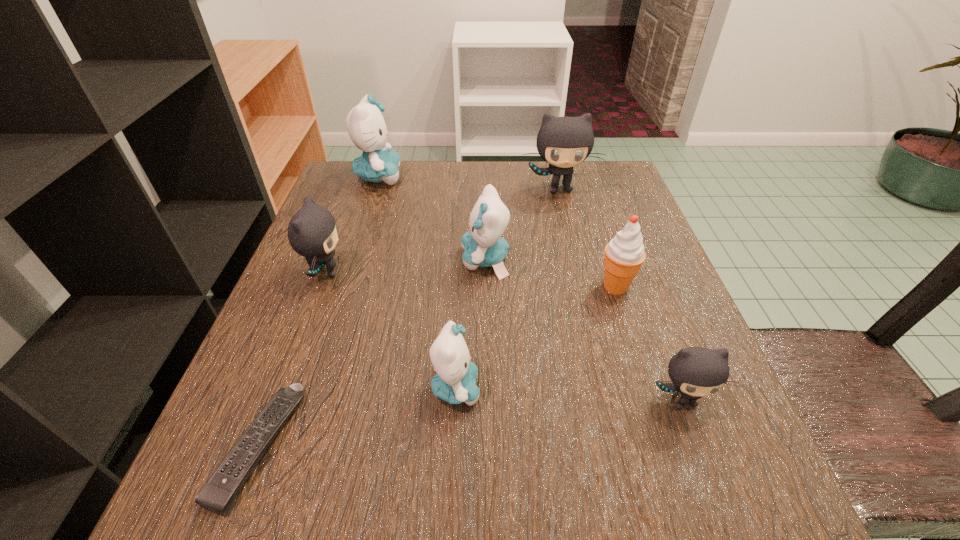
Locate an element on the screen. free location located 0.210m on the face of the leftmost blue kitten is located at coordinates (486, 177).

The width and height of the screenshot is (960, 540). Identify the location of vacant space positioned 0.370m on the front-facing side of the biggest gray kitten. (590, 318).

At what (x,y) coordinates should I click in order to perform the action: click on free region located 0.100m on the front of the icecream. Please return your answer as a coordinate pair (x, y). The width and height of the screenshot is (960, 540). Looking at the image, I should click on (634, 343).

The image size is (960, 540). Find the location of `blank space located 0.100m on the face of the second biggest blue kitten`. blank space located 0.100m on the face of the second biggest blue kitten is located at coordinates (411, 260).

Identify the location of free space located on the face of the second biggest blue kitten. The height and width of the screenshot is (540, 960). (330, 260).

Where is `vacant point located on the face of the second biggest blue kitten`? vacant point located on the face of the second biggest blue kitten is located at coordinates (350, 260).

You are a GUI agent. You are given a task and a screenshot of the screen. Output one action in this format:
    pyautogui.click(x=<x>, y=<y>)
    Task: Click on the vacant region located 0.110m on the front-facing side of the second smallest gray kitten
    The image size is (960, 540).
    Given the screenshot: What is the action you would take?
    pyautogui.click(x=404, y=272)

This screenshot has width=960, height=540. What are the coordinates of `free space located on the face of the nearest blue kitten` in the screenshot? It's located at (659, 388).

Locate an element on the screen. The width and height of the screenshot is (960, 540). free space located 0.060m on the front-facing side of the smallest gray kitten is located at coordinates (705, 461).

I want to click on free region located 0.180m on the back of the remote control, so click(313, 301).